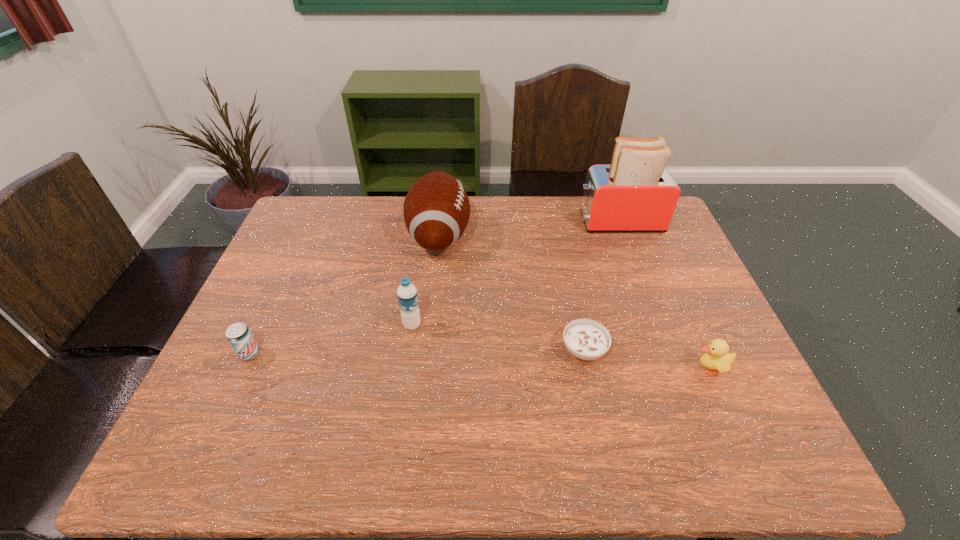
This screenshot has height=540, width=960. Identify the location of unoccupied area between the fourth object from left to right and the duckling. (647, 359).

Locate an element on the screen. blank region between the fourth object from left to right and the football is located at coordinates (512, 293).

What are the coordinates of `free space between the toaster and the football` in the screenshot? It's located at (529, 229).

In order to click on unoccupied area between the duckling and the football in this screenshot , I will do `click(574, 302)`.

Image resolution: width=960 pixels, height=540 pixels. I want to click on vacant space that is in between the third object from right to left and the duckling, so click(x=647, y=359).

Identify the location of empty space that is in between the beer can and the soup bowl. (417, 352).

The width and height of the screenshot is (960, 540). Identify the location of vacant region between the fourth object from left to right and the football. (512, 293).

At what (x,y) coordinates should I click in order to perform the action: click on vacant space that's between the tallest object and the beer can. Please return your answer as a coordinate pair (x, y). The height and width of the screenshot is (540, 960). Looking at the image, I should click on (434, 287).

Locate an element on the screen. Image resolution: width=960 pixels, height=540 pixels. the fourth closest object relative to the duckling is located at coordinates point(407,295).

Locate which object ranks second in proximity to the toaster. Please provide its 2D coordinates. Your answer should be formatted as a tuple, i.e. [(x, y)], where the tuple contains the x and y coordinates of a point satisfying the conditions above.

[(586, 339)]